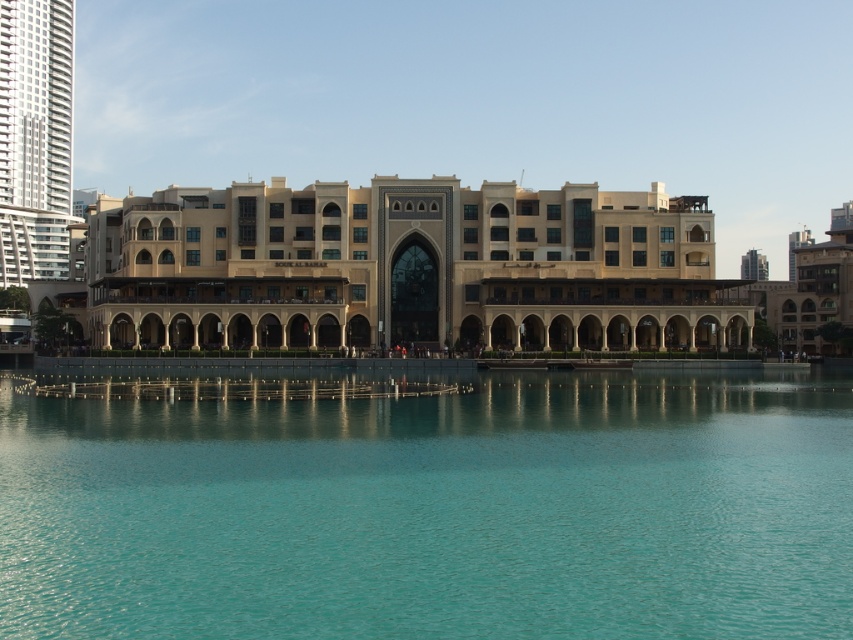
You are an architect designing a new building. You want to ensure that the new building will not block the view of the white glass skyscraper at left from the turquoise liquid at center. Based on the current scene, what should you consider about their heights?

The turquoise liquid at center has a lesser height compared to white glass skyscraper at left. Therefore, to avoid blocking the view of the white glass skyscraper at left from the turquoise liquid at center, the new building should be designed with a height lower than the white glass skyscraper at left.

You are an architect visiting the site and need to determine the placement of a new statue. The statue requires a base that must be larger than the existing turquoise liquid at center but smaller than the beige stone building at center. Can you place it on the existing structure? Explain your reasoning.

The turquoise liquid at center has a smaller size compared to the beige stone building at center. Therefore, the statue base can be placed on the beige stone building at center since it is larger than the turquoise liquid at center, but ensure the base size stays within the building dimensions.

You are standing at the point marked as point (436, 512). You want to walk towards the turquoise liquid at center. Which direction should you go?

The turquoise liquid at center is located at point (436, 512), so you are already standing on the turquoise liquid at center.